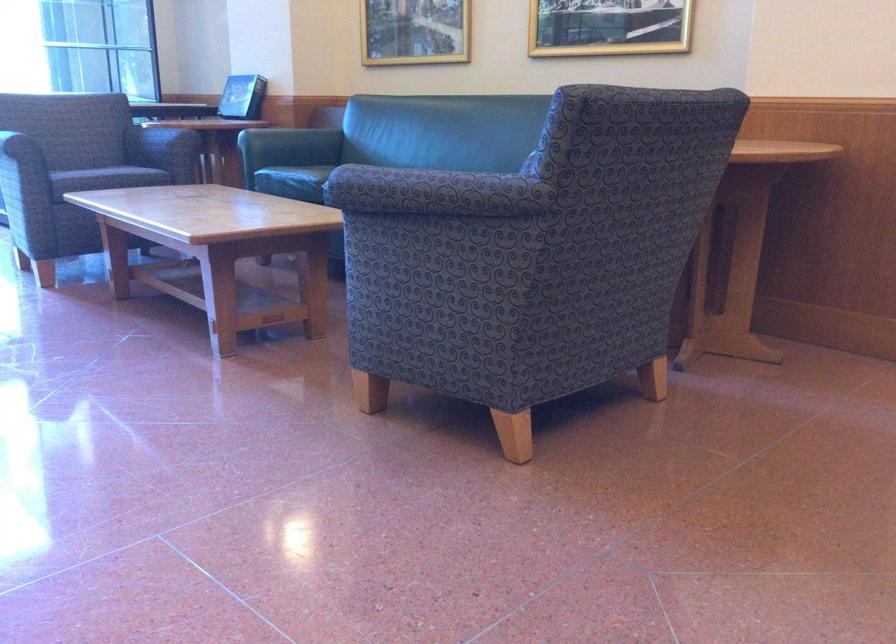
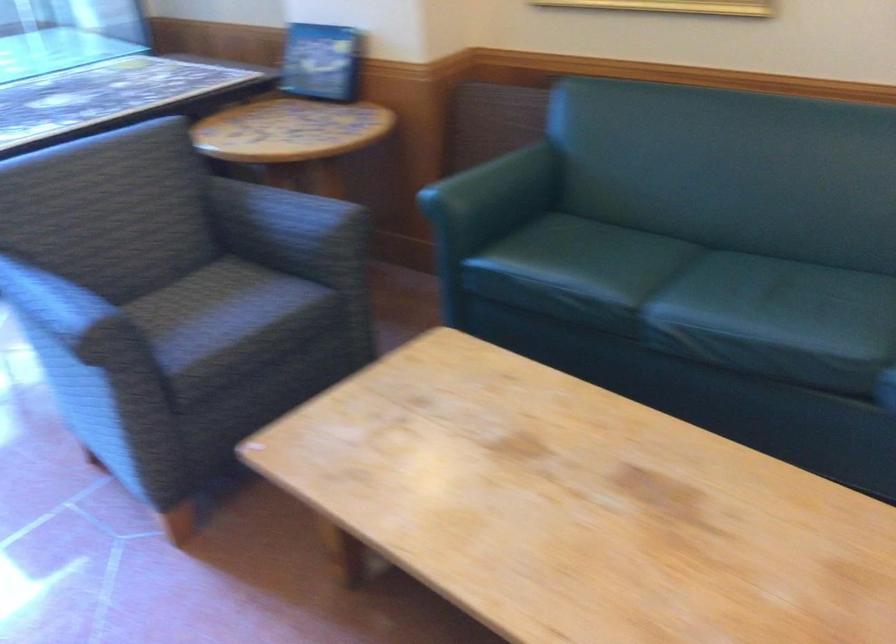
The point at (225,87) is marked in the first image. Where is the corresponding point in the second image?

(321, 62)